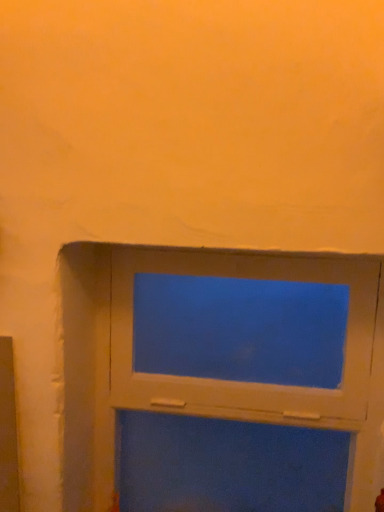
The width and height of the screenshot is (384, 512). What do you see at coordinates (240, 380) in the screenshot?
I see `white plastic window at upper center` at bounding box center [240, 380].

The height and width of the screenshot is (512, 384). I want to click on white plastic window at upper center, so click(240, 380).

The image size is (384, 512). Find the location of `white plastic window at upper center`. white plastic window at upper center is located at coordinates tap(240, 380).